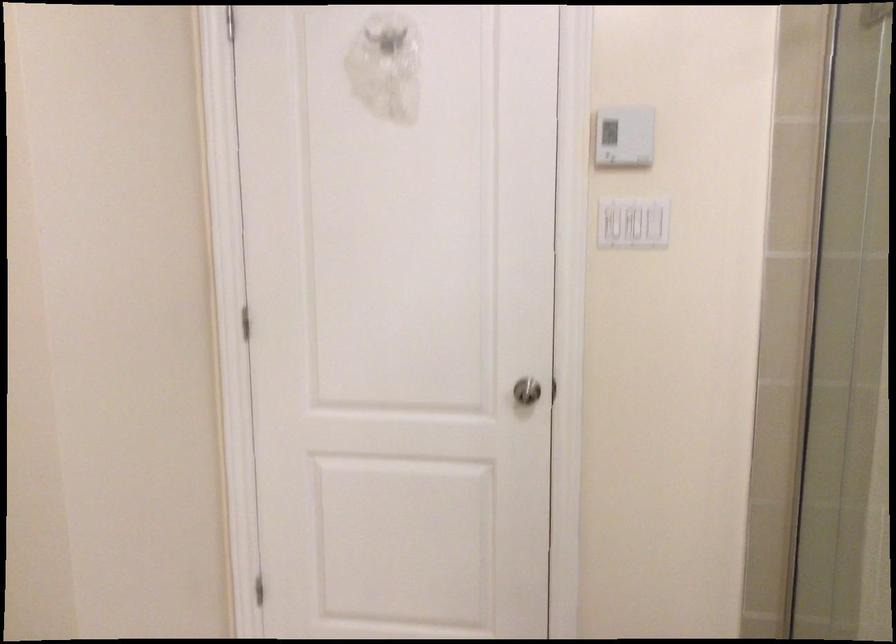
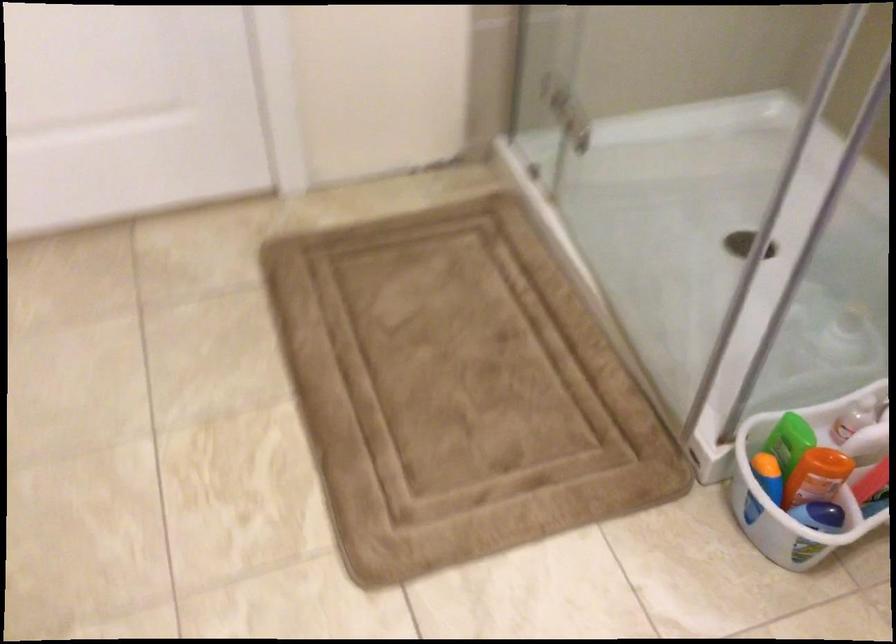
Based on the continuous images, in which direction is the camera rotating?

The rotation direction of the camera is right-down.